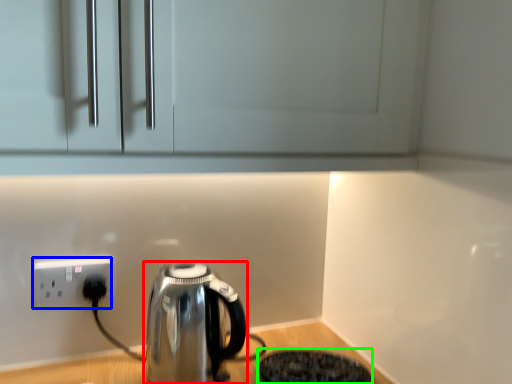
Question: Considering the real-world distances, which object is farthest from kettle (highlighted by a red box)? power plugs and sockets (highlighted by a blue box) or appliance (highlighted by a green box)?

Choices:
 (A) power plugs and sockets
 (B) appliance

Answer: (A)